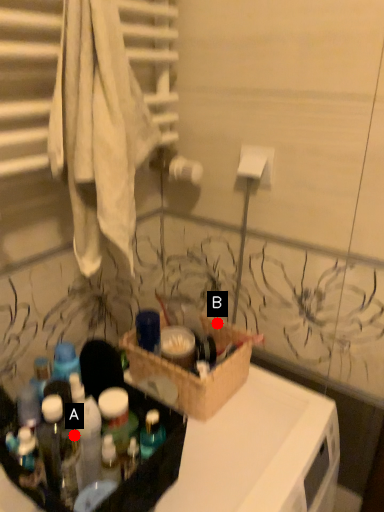
Question: Two points are circled on the image, labeled by A and B beside each circle. Which point is closer to the camera?

Choices:
 (A) A is closer
 (B) B is closer

Answer: (A)